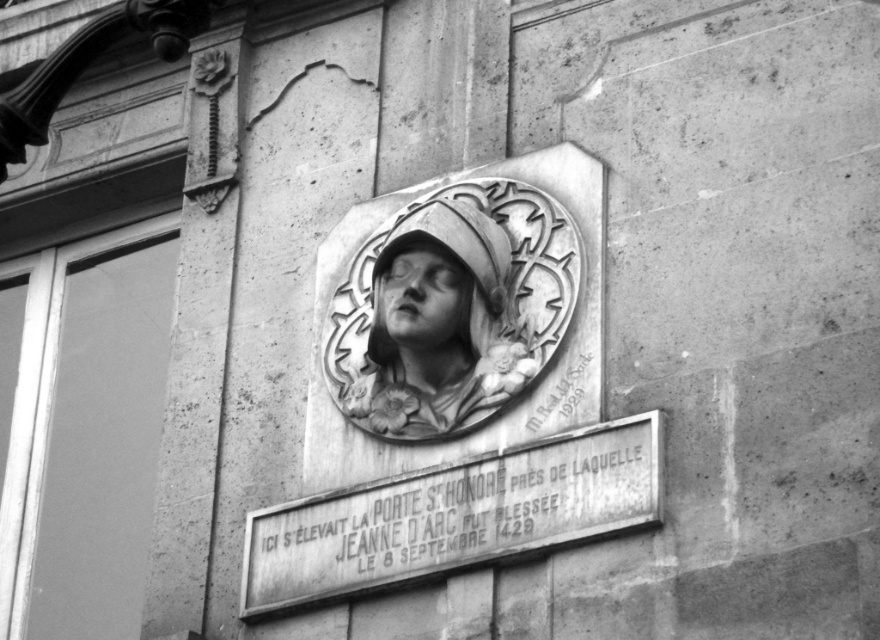
Who is higher up, white stone plaque at center or white marble bust at center?

white marble bust at center is above.

The image size is (880, 640). Describe the element at coordinates (460, 513) in the screenshot. I see `white stone plaque at center` at that location.

I want to click on white stone plaque at center, so click(x=460, y=513).

What do you see at coordinates (438, 326) in the screenshot? I see `white marble bust at center` at bounding box center [438, 326].

Is white marble bust at center behind matte stone face at center?

Yes.

Find the location of a particular element. The height and width of the screenshot is (640, 880). white marble bust at center is located at coordinates (438, 326).

Does white stone plaque at center have a greater width compared to matte stone face at center?

Indeed, white stone plaque at center has a greater width compared to matte stone face at center.

Between white stone plaque at center and matte stone face at center, which one appears on the right side from the viewer's perspective?

white stone plaque at center

Between point (644, 449) and point (440, 308), which one is positioned in front?

Point (644, 449) is more forward.

Locate an element on the screen. white stone plaque at center is located at coordinates (460, 513).